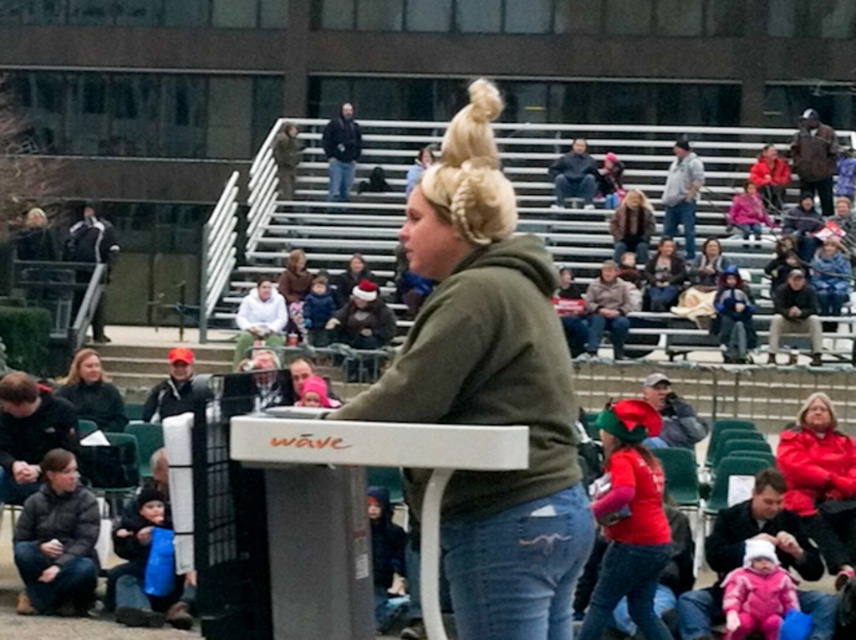
You are standing at point (x=758, y=596) and want to walk to point (x=590, y=307). Which direction should you move?

You should move backward because point (x=758, y=596) is in front of point (x=590, y=307).

You are a photographer at the event and want to capture both the dark gray jacket at lower left and the camouflage fabric jacket at upper center in a single shot. Which jacket will appear larger in the photo?

The dark gray jacket at lower left will appear larger in the photo because it is closer to the viewer than the camouflage fabric jacket at upper center.